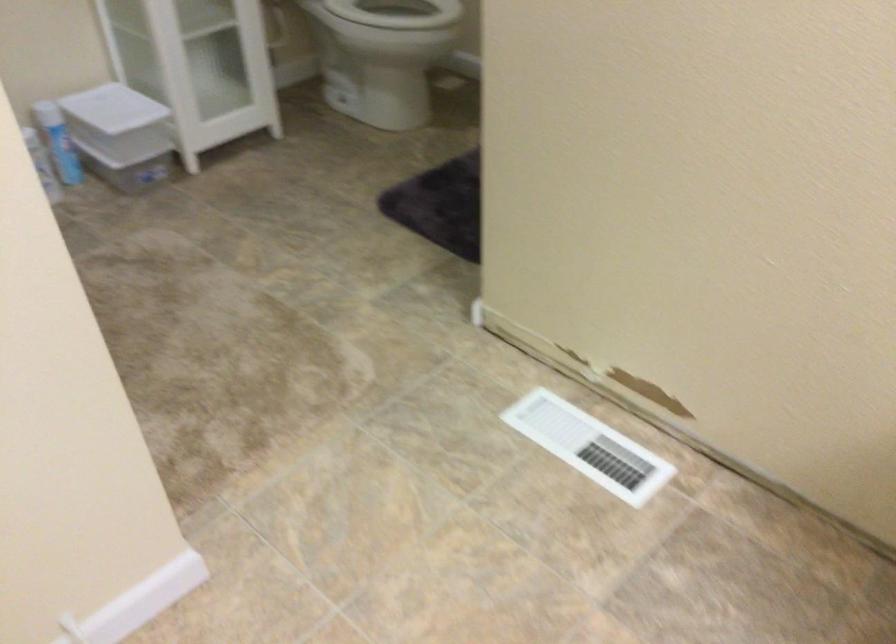
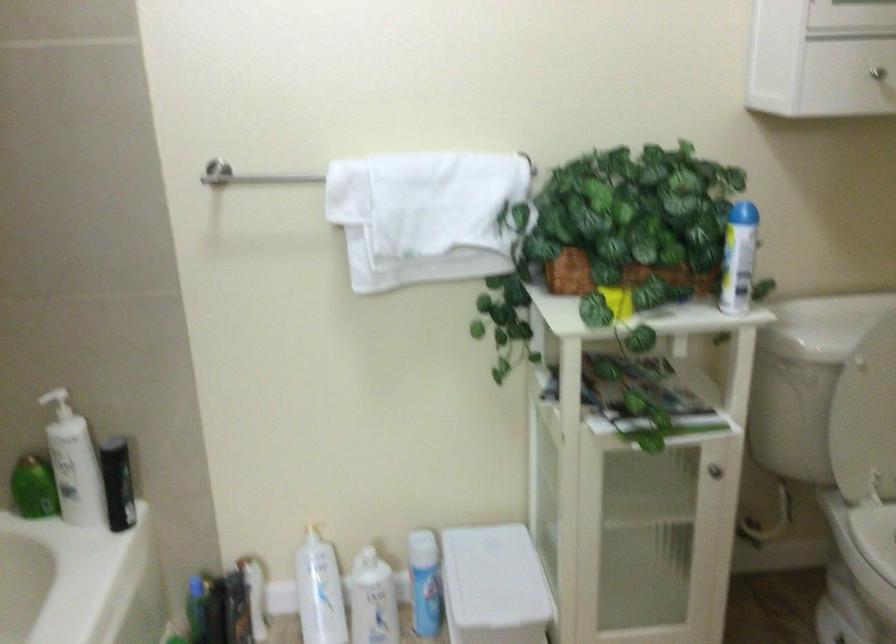
Find the pixel in the second image that matches (x=73, y=137) in the first image.

(424, 583)